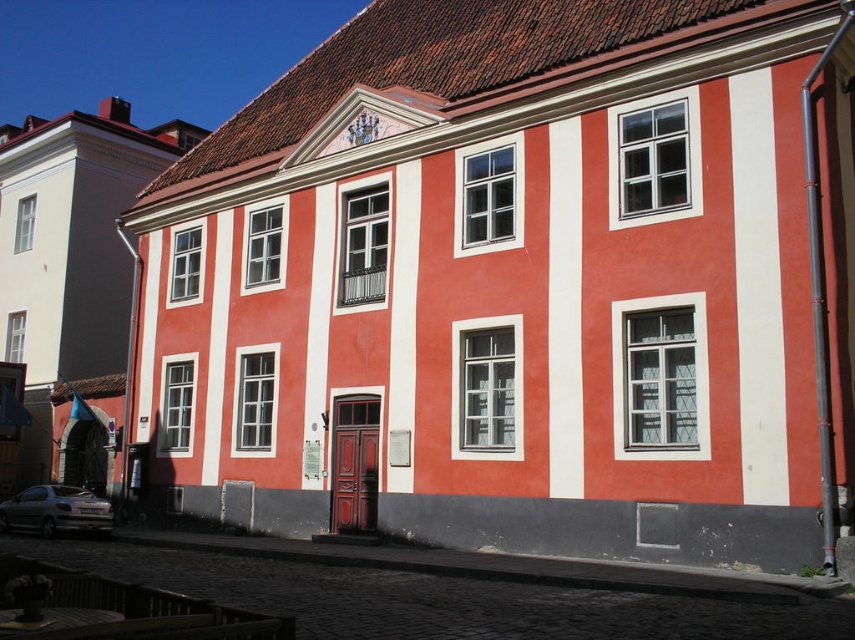
You are standing in front of the two story building and want to walk from point (747, 470) to point (553, 310). Which direction should you move to reach your destination?

Since point (747, 470) is in front of point (553, 310), you should move backward to reach your destination.

You are standing in front of the two story building and want to take a photo. The camera is at your eye level. You notice two points marked on the building. The first point is at coordinate point (771, 259) and the second point is at coordinate point (89, 506). Which point will appear larger in the photo?

Point (771, 259) is closer to the camera than point (89, 506), so it will appear larger in the photo.

You are a delivery person trying to park your matte silver car at lower left near the white matte stripe at right on the cobblestone street. Can your car fit next to the stripe without overlapping it?

The white matte stripe at right is thinner than the matte silver car at lower left, so the car is wider than the stripe. Therefore, the matte silver car at lower left cannot fit next to the white matte stripe at right without overlapping it.